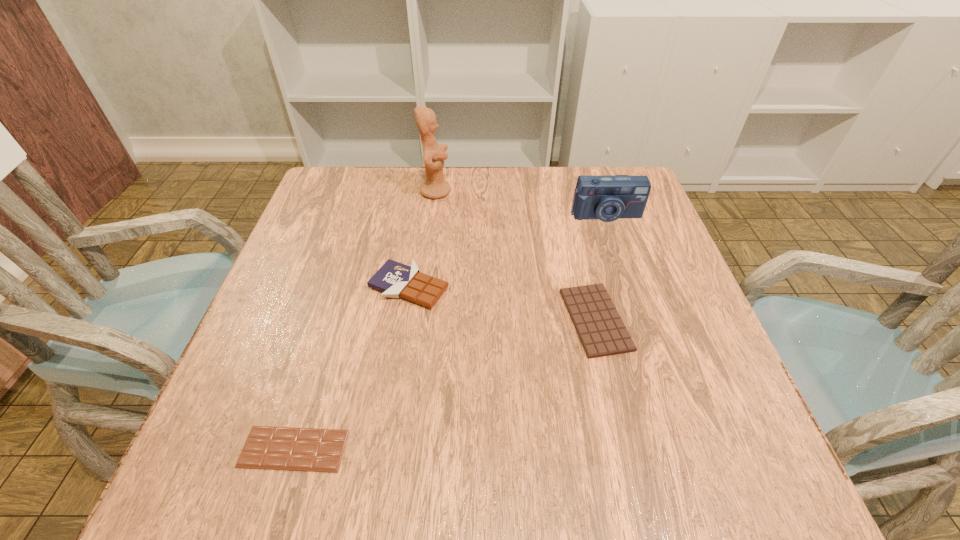
At what (x,y) coordinates should I click in order to perform the action: click on object that is positioned at the near left corner. Please return your answer as a coordinate pair (x, y). Looking at the image, I should click on (275, 448).

I want to click on object present at the far right corner, so click(x=609, y=197).

The height and width of the screenshot is (540, 960). In the image, there is a desktop. Identify the location of free region at the far edge. (554, 180).

Find the location of `free location at the left edge of the desktop`. free location at the left edge of the desktop is located at coordinates (296, 319).

Locate an element on the screen. The image size is (960, 540). blank space at the right edge of the desktop is located at coordinates (656, 259).

This screenshot has height=540, width=960. I want to click on vacant space at the far left corner of the desktop, so click(340, 178).

In the image, there is a desktop. Identify the location of vacant space at the near right corner. This screenshot has height=540, width=960. (689, 463).

Find the location of `free space between the nearest object and the fourth nearest object`. free space between the nearest object and the fourth nearest object is located at coordinates (449, 332).

The width and height of the screenshot is (960, 540). Identify the location of vacant region between the third tallest object and the second farthest object. (507, 251).

The image size is (960, 540). I want to click on free space between the second tallest object and the nearest object, so click(x=449, y=332).